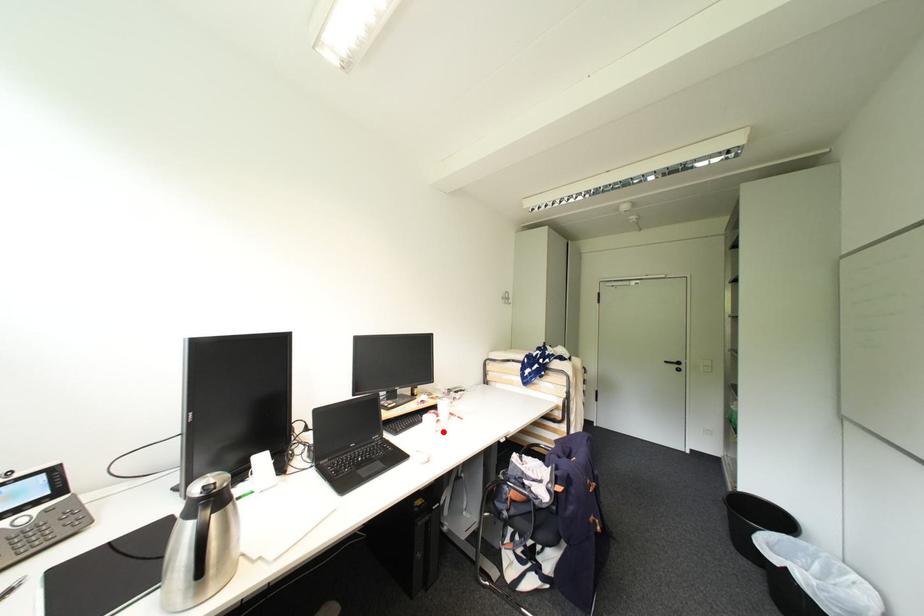
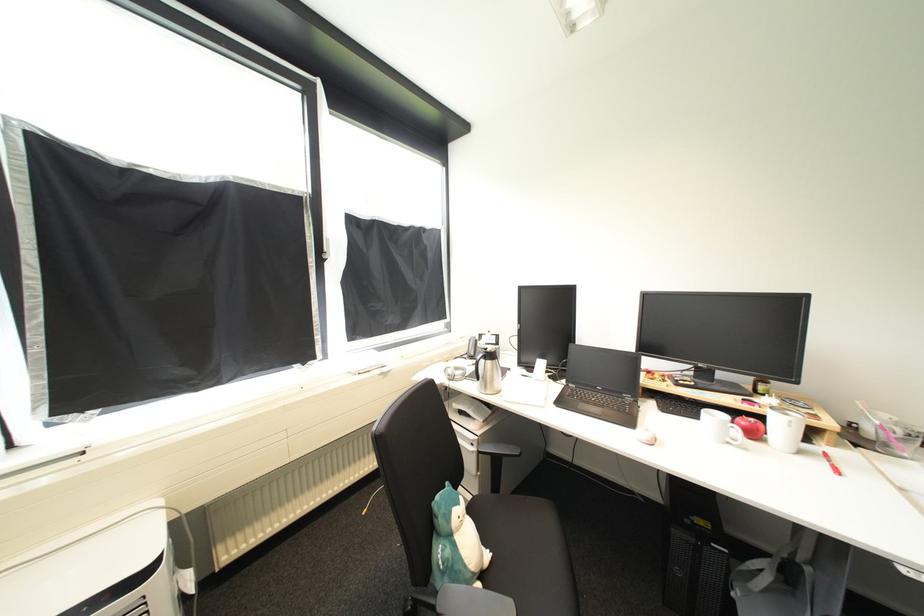
The point at the highlighted location is marked in the first image. Where is the corresponding point in the second image?

(736, 445)